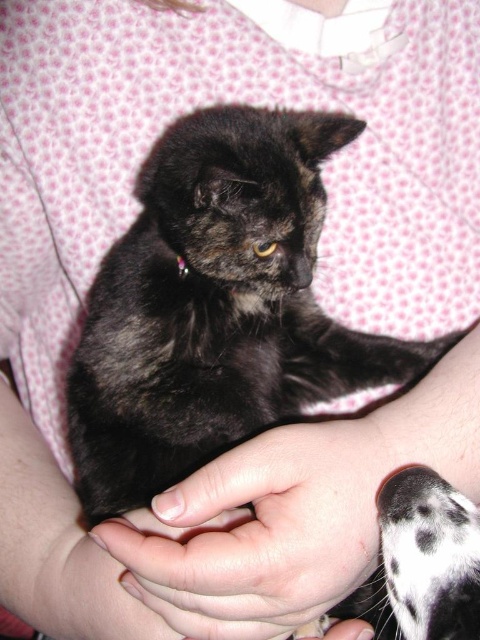
Question: Is smooth skin hand at center positioned at the back of black and white fur at lower right?

Choices:
 (A) yes
 (B) no

Answer: (A)

Question: Among these objects, which one is farthest from the camera?

Choices:
 (A) smooth skin hand at center
 (B) black and white fur at lower right

Answer: (A)

Question: Can you confirm if shiny black cat at center is smaller than black and white fur at lower right?

Choices:
 (A) yes
 (B) no

Answer: (B)

Question: Which object is the farthest from the shiny black cat at center?

Choices:
 (A) black and white fur at lower right
 (B) smooth skin hand at center

Answer: (A)

Question: Considering the relative positions of shiny black cat at center and smooth skin hand at center in the image provided, where is shiny black cat at center located with respect to smooth skin hand at center?

Choices:
 (A) below
 (B) above

Answer: (B)

Question: Which object is the closest to the smooth skin hand at center?

Choices:
 (A) black and white fur at lower right
 (B) shiny black cat at center

Answer: (A)